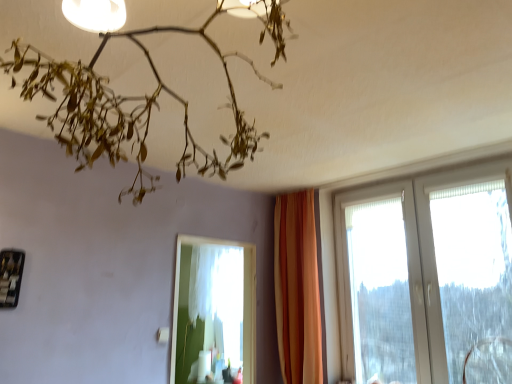
The image size is (512, 384). I want to click on white plastic window at right, so click(423, 272).

I want to click on orange fabric curtain at center, so click(297, 289).

Image resolution: width=512 pixels, height=384 pixels. Describe the element at coordinates (10, 276) in the screenshot. I see `metallic black picture frame at lower left` at that location.

This screenshot has width=512, height=384. In order to click on white plastic window at right in this screenshot , I will do `click(423, 272)`.

Is orange fabric curtain at center inside the boundaries of metallic black picture frame at lower left, or outside?

orange fabric curtain at center is not enclosed by metallic black picture frame at lower left.

Considering the relative positions of orange fabric curtain at center and metallic black picture frame at lower left in the image provided, is orange fabric curtain at center to the left or to the right of metallic black picture frame at lower left?

orange fabric curtain at center is positioned on metallic black picture frame at lower left's right side.

Could you tell me if orange fabric curtain at center is facing metallic black picture frame at lower left?

Yes, orange fabric curtain at center is turned towards metallic black picture frame at lower left.

Is orange fabric curtain at center next to metallic black picture frame at lower left and touching it?

orange fabric curtain at center is not next to metallic black picture frame at lower left, and they're not touching.

Between matte white lamp at upper center and white sheer curtain at center, which one has less height?

With less height is matte white lamp at upper center.

Locate an element on the screen. lamp in front of the white sheer curtain at center is located at coordinates (139, 101).

Is matte white lamp at upper center at the right side of white sheer curtain at center?

Yes.

Consider the image. Which point is more forward, [48,76] or [218,332]?

The point [48,76] is in front.

Is white sheer curtain at center oriented towards transparent plastic swivel chair at lower right?

Yes, white sheer curtain at center is turned towards transparent plastic swivel chair at lower right.

This screenshot has width=512, height=384. I want to click on swivel chair that appears below the white sheer curtain at center (from a real-world perspective), so click(480, 346).

Considering the points (246, 349) and (465, 378), which point is in front, point (246, 349) or point (465, 378)?

The point (465, 378) is more forward.

In the scene shown: Is the depth of metallic black picture frame at lower left less than that of white sheer curtain at center?

Yes.

Based on their sizes in the image, would you say metallic black picture frame at lower left is bigger or smaller than white sheer curtain at center?

In the image, metallic black picture frame at lower left appears to be smaller than white sheer curtain at center.

Are metallic black picture frame at lower left and white sheer curtain at center far apart?

Absolutely, metallic black picture frame at lower left is distant from white sheer curtain at center.

Would you say metallic black picture frame at lower left is outside orange fabric curtain at center?

metallic black picture frame at lower left is positioned outside orange fabric curtain at center.

Is metallic black picture frame at lower left bigger than orange fabric curtain at center?

No.

From a real-world perspective, between metallic black picture frame at lower left and orange fabric curtain at center, who is vertically lower?

orange fabric curtain at center is physically lower.

Between point (13, 284) and point (308, 308), which one is positioned behind?

The point (308, 308) is behind.

Is the surface of metallic black picture frame at lower left in direct contact with white plastic window at right?

No, metallic black picture frame at lower left is not making contact with white plastic window at right.

From the image's perspective, relative to white plastic window at right, is metallic black picture frame at lower left above or below?

From the image's perspective, metallic black picture frame at lower left appears above white plastic window at right.

Identify the location of picture frame lying on the left of white plastic window at right. (10, 276).

Is metallic black picture frame at lower left oriented towards white plastic window at right?

No, metallic black picture frame at lower left is not facing towards white plastic window at right.

Between point (255, 293) and point (319, 329), which one is positioned behind?

The point (255, 293) is farther from the camera.

Considering the relative sizes of white sheer curtain at center and orange fabric curtain at center in the image provided, is white sheer curtain at center wider than orange fabric curtain at center?

In fact, white sheer curtain at center might be narrower than orange fabric curtain at center.

Is white sheer curtain at center taller than orange fabric curtain at center?

Incorrect, the height of white sheer curtain at center is not larger of that of orange fabric curtain at center.

From a real-world perspective, does white sheer curtain at center sit lower than orange fabric curtain at center?

Correct, in the physical world, white sheer curtain at center is lower than orange fabric curtain at center.

Image resolution: width=512 pixels, height=384 pixels. I want to click on curtain that is below the metallic black picture frame at lower left (from the image's perspective), so click(x=297, y=289).

Locate an element on the screen. This screenshot has height=384, width=512. bay window behind the matte white lamp at upper center is located at coordinates (213, 311).

From the image, which object appears to be nearer to white plastic window at right, metallic black picture frame at lower left or transparent plastic swivel chair at lower right?

Based on the image, transparent plastic swivel chair at lower right appears to be nearer to white plastic window at right.

Based on the photo, when comparing their distances from metallic black picture frame at lower left, does white plastic window at right or white sheer curtain at center seem further?

The object further to metallic black picture frame at lower left is white plastic window at right.

Based on their spatial positions, is white plastic window at right or orange fabric curtain at center further from white sheer curtain at center?

white plastic window at right is positioned further to the anchor white sheer curtain at center.

Based on their spatial positions, is matte white lamp at upper center or transparent plastic swivel chair at lower right further from white plastic window at right?

matte white lamp at upper center is further to white plastic window at right.

When comparing their distances from orange fabric curtain at center, does metallic black picture frame at lower left or white plastic window at right seem further?

metallic black picture frame at lower left lies further to orange fabric curtain at center than the other object.

When comparing their distances from metallic black picture frame at lower left, does matte white lamp at upper center or white sheer curtain at center seem closer?

Among the two, matte white lamp at upper center is located nearer to metallic black picture frame at lower left.

Considering their positions, is transparent plastic swivel chair at lower right positioned further to orange fabric curtain at center than white sheer curtain at center?

The object further to orange fabric curtain at center is transparent plastic swivel chair at lower right.

From the picture: When comparing their distances from matte white lamp at upper center, does white plastic window at right or transparent plastic swivel chair at lower right seem further?

Among the two, transparent plastic swivel chair at lower right is located further to matte white lamp at upper center.

Identify the location of curtain situated between metallic black picture frame at lower left and white plastic window at right from left to right. The height and width of the screenshot is (384, 512). (297, 289).

Image resolution: width=512 pixels, height=384 pixels. I want to click on window located between matte white lamp at upper center and orange fabric curtain at center in the depth direction, so click(423, 272).

Identify the location of picture frame between matte white lamp at upper center and white sheer curtain at center in the front-back direction. (10, 276).

Identify the location of swivel chair between matte white lamp at upper center and white sheer curtain at center in the front-back direction. This screenshot has width=512, height=384. (480, 346).